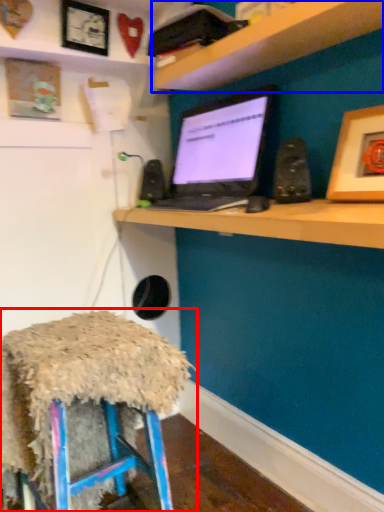
Question: Among these objects, which one is nearest to the camera, stool (highlighted by a red box) or shelf (highlighted by a blue box)?

Choices:
 (A) stool
 (B) shelf

Answer: (B)